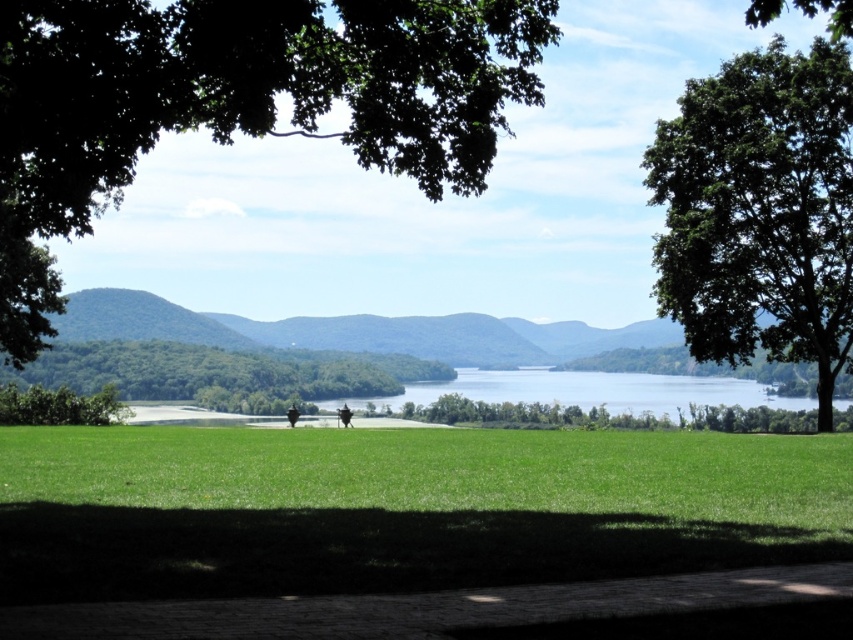
Does green leafy tree at upper left have a larger size compared to green leafy tree at upper right?

Yes.

Does green leafy tree at upper left have a lesser width compared to green leafy tree at upper right?

No, green leafy tree at upper left is not thinner than green leafy tree at upper right.

Does point (41, 145) come closer to viewer compared to point (834, 376)?

Yes, it is.

Find the location of `green leafy tree at upper left`. green leafy tree at upper left is located at coordinates (236, 102).

Does green leafy tree at upper left appear on the left side of green leafy tree at center?

In fact, green leafy tree at upper left is to the right of green leafy tree at center.

Between point (18, 83) and point (200, 403), which one is positioned behind?

Point (200, 403)

Find the location of a particular element. green leafy tree at upper left is located at coordinates (236, 102).

Identify the location of green leafy tree at upper left. This screenshot has width=853, height=640. (236, 102).

Is green leafy tree at upper left shorter than dark green grass at center?

In fact, green leafy tree at upper left may be taller than dark green grass at center.

Identify the location of green leafy tree at upper left. (236, 102).

Does point (80, 35) lie in front of point (341, 424)?

Yes, it is.

Identify the location of green leafy tree at upper left. (236, 102).